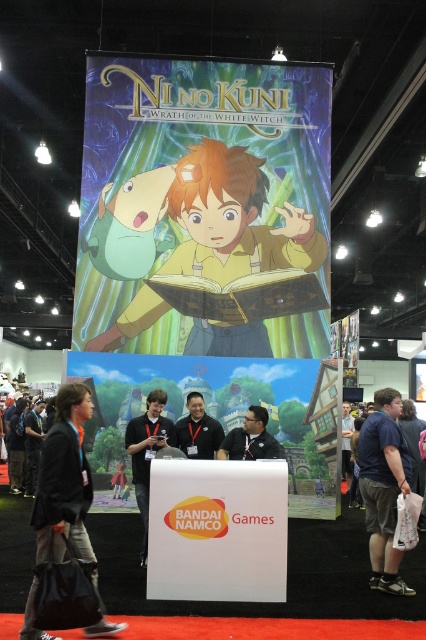
Can you confirm if dark brown leather jacket at center is smaller than black fabric shirt at center?

Indeed, dark brown leather jacket at center has a smaller size compared to black fabric shirt at center.

Locate an element on the screen. dark brown leather jacket at center is located at coordinates (250, 438).

The image size is (426, 640). I want to click on dark brown leather jacket at center, so pos(250,438).

Is matte yellow shirt at center bigger than dark brown leather jacket at center?

Yes.

I want to click on matte yellow shirt at center, so click(207, 252).

What do you see at coordinates (146, 451) in the screenshot?
I see `matte black shirt at center` at bounding box center [146, 451].

Is matte black shirt at center in front of dark brown leather jacket at center?

Yes.

Image resolution: width=426 pixels, height=640 pixels. What do you see at coordinates (146, 451) in the screenshot? I see `matte black shirt at center` at bounding box center [146, 451].

Locate an element on the screen. The height and width of the screenshot is (640, 426). matte black shirt at center is located at coordinates (146, 451).